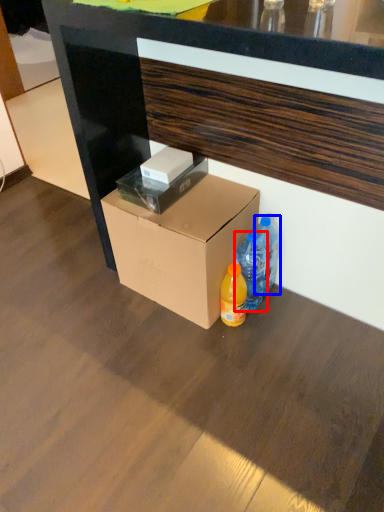
Question: Which object is further to the camera taking this photo, bottle (highlighted by a red box) or bottle (highlighted by a blue box)?

Choices:
 (A) bottle
 (B) bottle

Answer: (B)